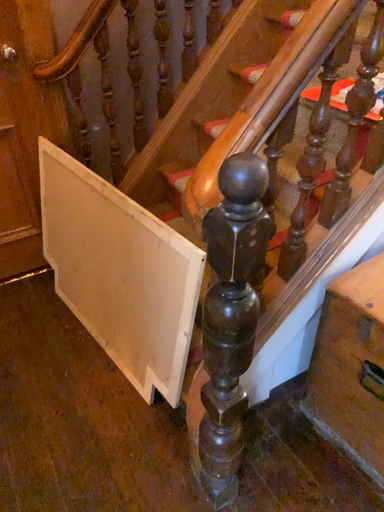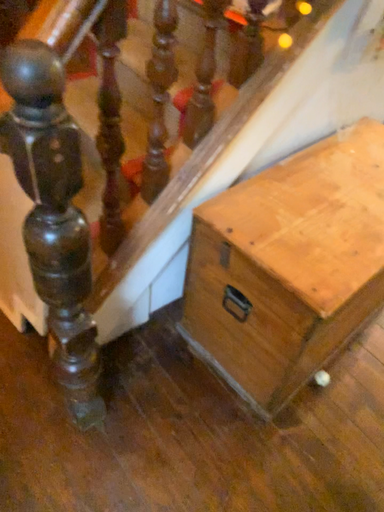
Question: How did the camera likely rotate when shooting the video?

Choices:
 (A) rotated right
 (B) rotated left

Answer: (A)